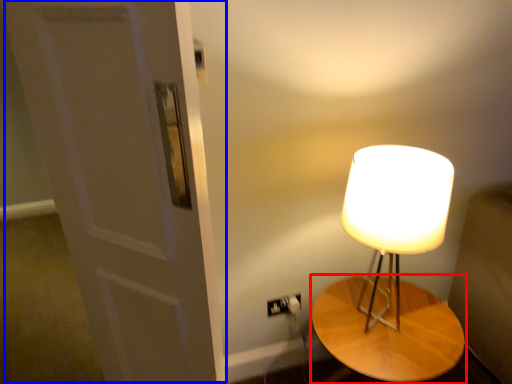
Question: Which object is further to the camera taking this photo, table (highlighted by a red box) or door (highlighted by a blue box)?

Choices:
 (A) table
 (B) door

Answer: (A)